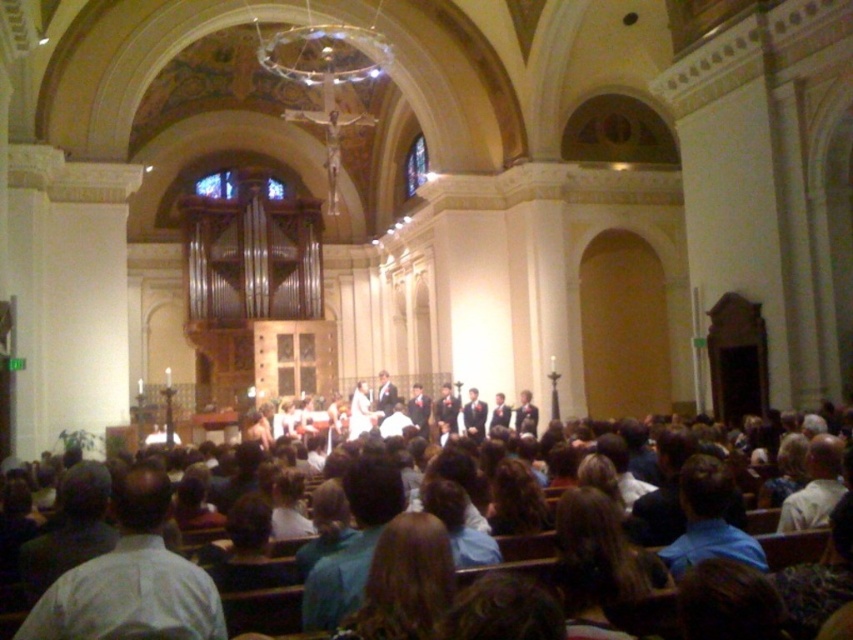
You are standing at the entrance of the church and want to locate the light blue shirt at lower left. According to the coordinates provided, where should you look to find it?

The light blue shirt at lower left is located at coordinates point (x=131, y=577).

You are a photographer standing at the back of the church and want to take a photo of the light brown wooden pews at center and the light blue shirt at lower left. Which object will appear taller in the photo?

The light brown wooden pews at center will appear taller in the photo because it is taller than the light blue shirt at lower left according to the description.

You are a photographer standing at the back of the church. You want to take a photo of the light blue shirt at lower left without the light brown wooden pews at center blocking the view. Is this possible?

The light brown wooden pews at center is positioned over the light blue shirt at lower left, so taking a photo from the back would result in the pews blocking the view of the light blue shirt at lower left. Therefore, it is not possible to capture the light blue shirt at lower left without obstruction.